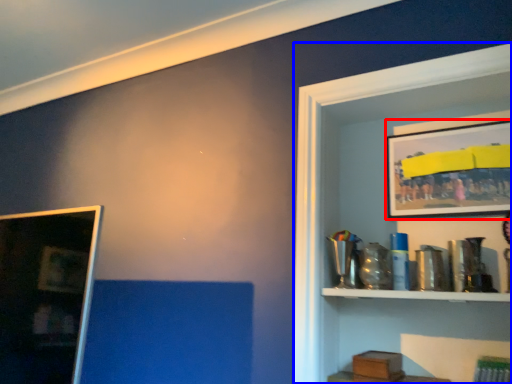
Question: Which object appears farthest to the camera in this image, picture frame (highlighted by a red box) or shelf (highlighted by a blue box)?

Choices:
 (A) picture frame
 (B) shelf

Answer: (A)